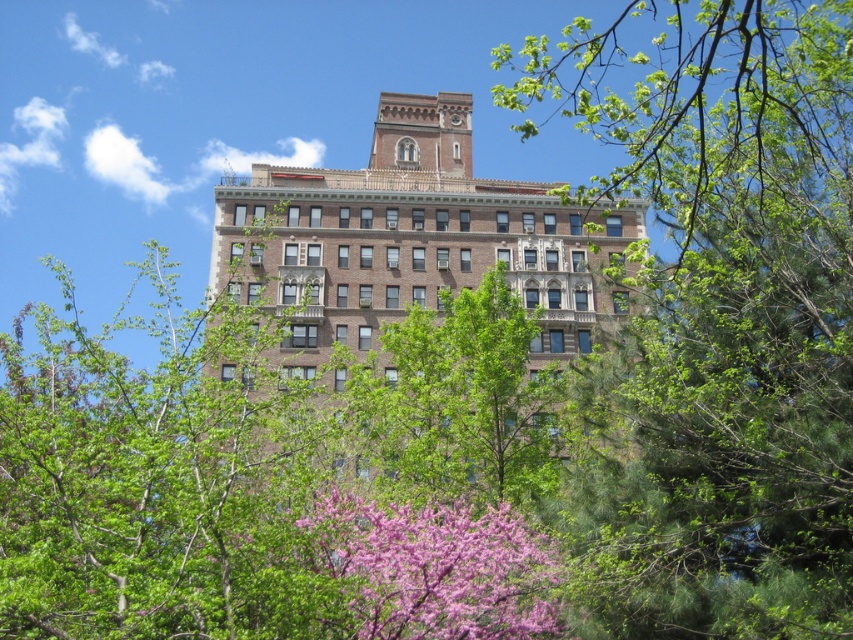
Question: Among these points, which one is nearest to the camera?

Choices:
 (A) (770, 371)
 (B) (260, 252)

Answer: (A)

Question: Can you confirm if green leafy tree at upper center is positioned to the right of brown brick building at center?

Choices:
 (A) no
 (B) yes

Answer: (B)

Question: Is green leafy tree at upper center wider than brown brick building at center?

Choices:
 (A) yes
 (B) no

Answer: (B)

Question: From the image, what is the correct spatial relationship of green leafy tree at upper center in relation to brown brick building at center?

Choices:
 (A) below
 (B) above

Answer: (B)